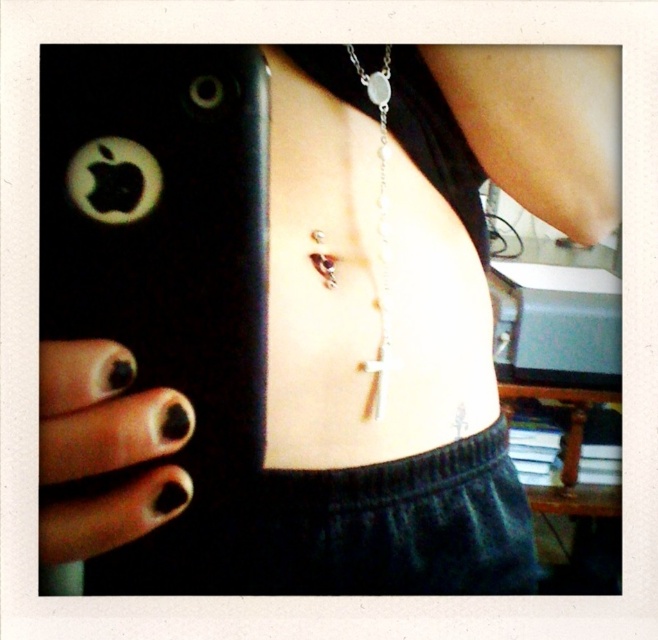
Question: Is black matte nails at lower left to the left of silver metallic chain at center from the viewer's perspective?

Choices:
 (A) no
 (B) yes

Answer: (B)

Question: Among these points, which one is nearest to the camera?

Choices:
 (A) (384, 280)
 (B) (184, 497)

Answer: (B)

Question: Is black matte nails at lower left smaller than silver metallic chain at center?

Choices:
 (A) yes
 (B) no

Answer: (A)

Question: Observing the image, what is the correct spatial positioning of black matte nails at lower left in reference to silver metallic chain at center?

Choices:
 (A) above
 (B) below

Answer: (B)

Question: Which object is closer to the camera taking this photo?

Choices:
 (A) black matte nails at lower left
 (B) silver metallic chain at center

Answer: (A)